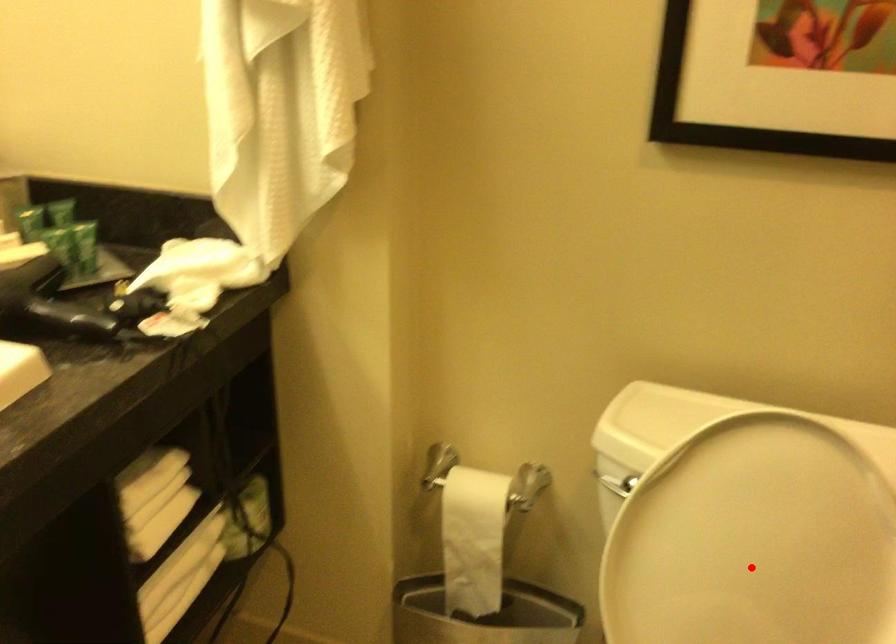
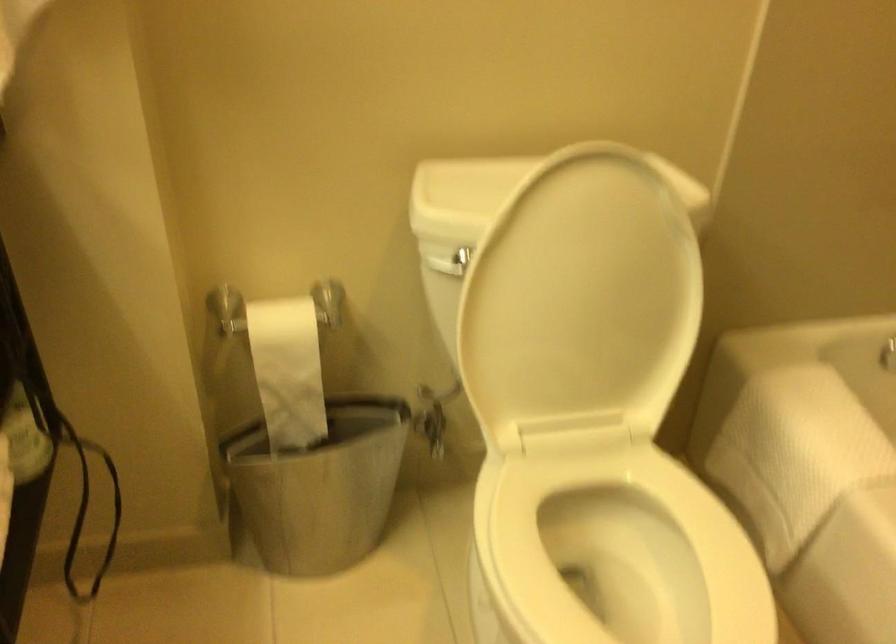
Question: I am providing you with two images of the same scene from different viewpoints. A red point is shown in image1. For the corresponding object point in image2, is it positioned nearer or farther from the camera?

Choices:
 (A) Nearer
 (B) Farther

Answer: (B)